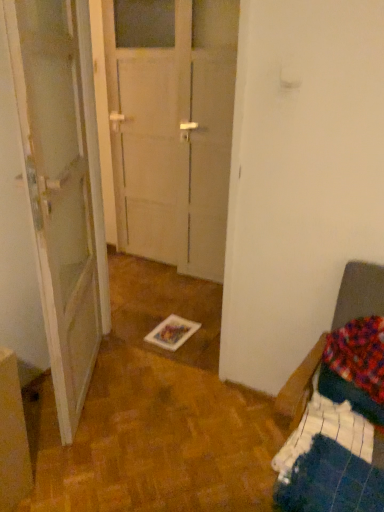
Question: Is dark blue fabric bed at right closer to camera compared to white glossy door at left?

Choices:
 (A) no
 (B) yes

Answer: (B)

Question: Could you tell me if dark blue fabric bed at right is turned towards white glossy door at left?

Choices:
 (A) yes
 (B) no

Answer: (B)

Question: Is dark blue fabric bed at right thinner than white glossy door at left?

Choices:
 (A) yes
 (B) no

Answer: (B)

Question: From a real-world perspective, does dark blue fabric bed at right stand above white glossy door at left?

Choices:
 (A) yes
 (B) no

Answer: (B)

Question: Is dark blue fabric bed at right positioned with its back to white glossy door at left?

Choices:
 (A) yes
 (B) no

Answer: (B)

Question: From their relative heights in the image, would you say white glossy door at left is taller or shorter than dark blue fabric bed at right?

Choices:
 (A) tall
 (B) short

Answer: (A)

Question: Is point (49, 330) positioned closer to the camera than point (365, 496)?

Choices:
 (A) farther
 (B) closer

Answer: (A)

Question: Based on their sizes in the image, would you say white glossy door at left is bigger or smaller than dark blue fabric bed at right?

Choices:
 (A) small
 (B) big

Answer: (B)

Question: Visually, is white glossy door at left positioned to the left or to the right of dark blue fabric bed at right?

Choices:
 (A) left
 (B) right

Answer: (A)

Question: In the image, is white glossy door at left positioned in front of or behind transparent glass door at center?

Choices:
 (A) front
 (B) behind

Answer: (A)

Question: Would you say white glossy door at left is to the left or to the right of transparent glass door at center in the picture?

Choices:
 (A) left
 (B) right

Answer: (A)

Question: Is white glossy door at left bigger or smaller than transparent glass door at center?

Choices:
 (A) big
 (B) small

Answer: (A)

Question: Is white glossy door at left taller or shorter than transparent glass door at center?

Choices:
 (A) tall
 (B) short

Answer: (B)

Question: Considering their positions, is transparent glass door at center located in front of or behind dark blue fabric bed at right?

Choices:
 (A) front
 (B) behind

Answer: (B)

Question: Does point (170, 150) appear closer or farther from the camera than point (382, 294)?

Choices:
 (A) farther
 (B) closer

Answer: (A)